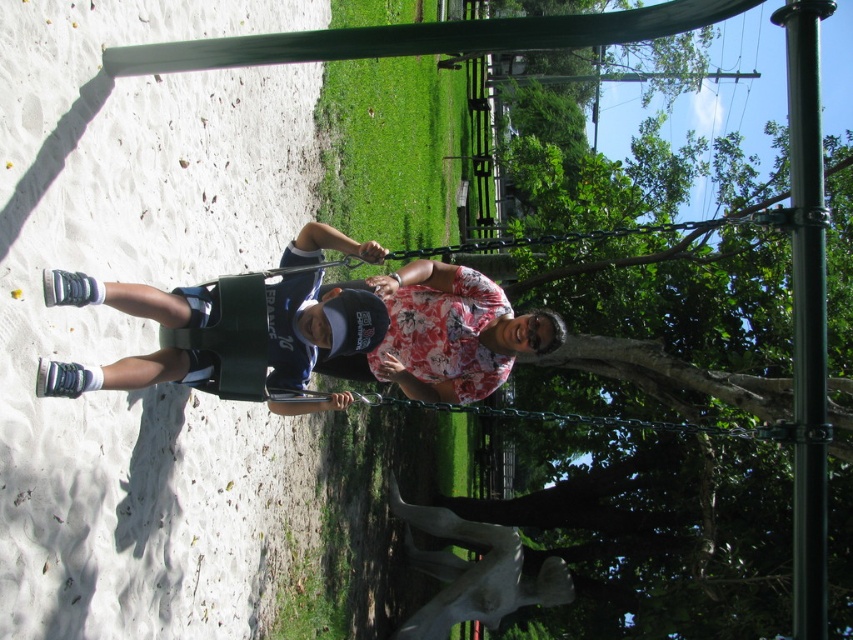
Question: Which of the following is the closest to the observer?

Choices:
 (A) (793, 96)
 (B) (62, 396)

Answer: (A)

Question: Is matte green wheelchair at left below green metallic pole at right?

Choices:
 (A) no
 (B) yes

Answer: (B)

Question: Which point is closer to the camera?

Choices:
 (A) matte green wheelchair at left
 (B) green metallic pole at right

Answer: (B)

Question: Among these points, which one is farthest from the camera?

Choices:
 (A) (310, 224)
 (B) (802, 108)

Answer: (A)

Question: Considering the relative positions of matte green wheelchair at left and green metallic pole at right in the image provided, where is matte green wheelchair at left located with respect to green metallic pole at right?

Choices:
 (A) left
 (B) right

Answer: (A)

Question: Is matte green wheelchair at left further to the viewer compared to green metallic pole at right?

Choices:
 (A) no
 (B) yes

Answer: (B)